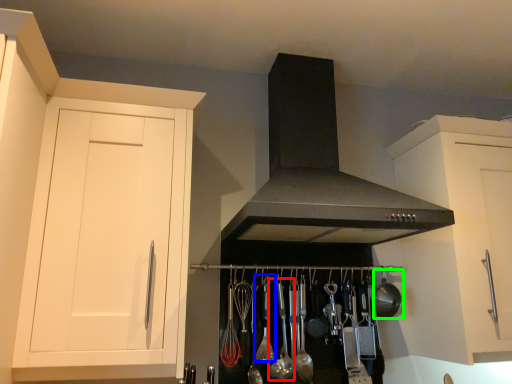
Question: Which object is positioned farthest from utensil (highlighted by a red box)? Select from utensil (highlighted by a blue box) and appliance (highlighted by a green box).

Choices:
 (A) utensil
 (B) appliance

Answer: (B)